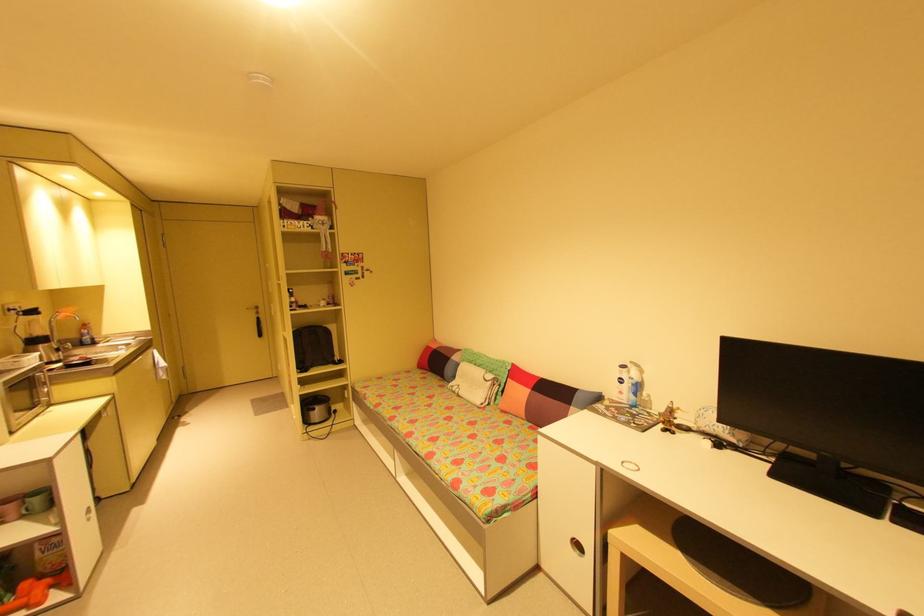
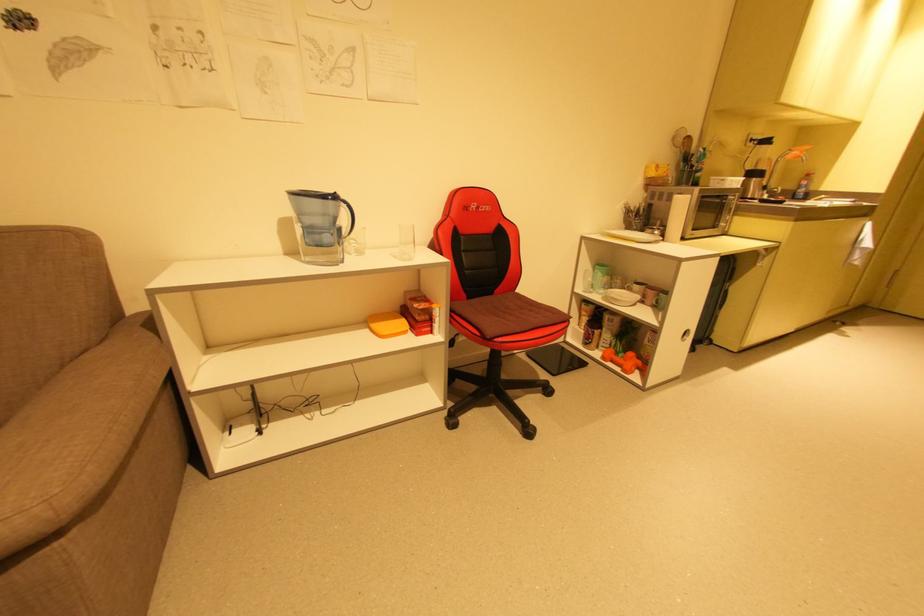
The first image is from the beginning of the video and the second image is from the end. How did the camera likely rotate when shooting the video?

The camera rotated toward left-down.